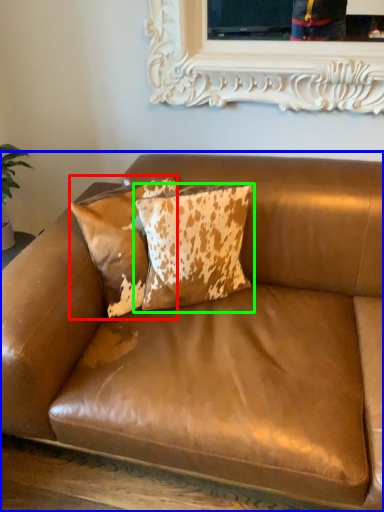
Question: Which is farther away from pillow (highlighted by a red box)? studio couch (highlighted by a blue box) or pillow (highlighted by a green box)?

Choices:
 (A) studio couch
 (B) pillow

Answer: (A)